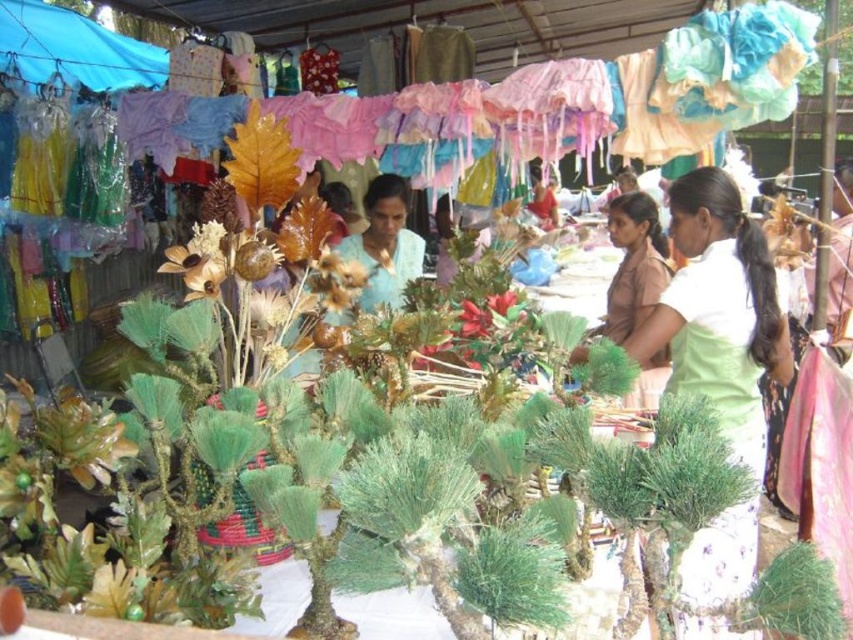
You are a photographer standing at the market entrance and want to take a photo of the green satin blouse at right. The camera requires a minimum distance of 30 inches to focus properly. Can you take a clear photo from your current position?

The distance between the green satin blouse at right and the camera is 33.09 inches, which is greater than the minimum required 30 inches. Therefore, you can take a clear photo from your current position.

You are a customer at the market and want to buy the green satin blouse at right. Based on its position, can you estimate where you should look to find it?

The green satin blouse at right is located at point 0.486 along the horizontal axis and 0.844 along the vertical axis, so you should look towards the upper right area of the image to find it.